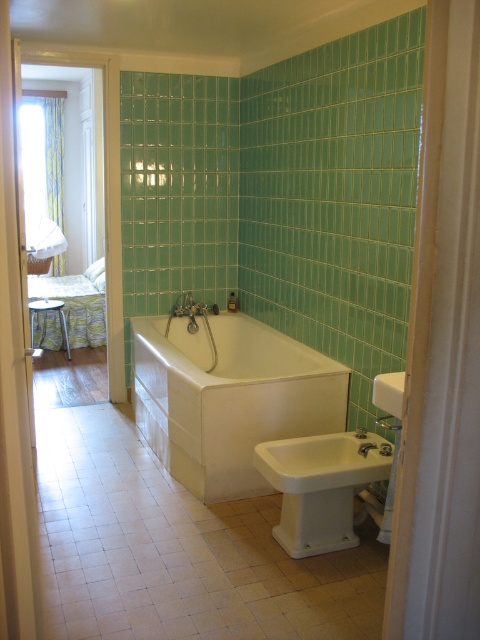
Question: Which of the following is the closest to the observer?

Choices:
 (A) white ceramic sink at lower center
 (B) white ceramic sink at lower right
 (C) white ceramic sink at center
 (D) white glossy bathtub at center

Answer: (C)

Question: Which is farther from the white ceramic sink at lower right?

Choices:
 (A) matte white shower at center
 (B) white ceramic sink at lower center

Answer: (A)

Question: Which point appears closest to the camera in this image?

Choices:
 (A) (392, 426)
 (B) (274, 337)
 (C) (388, 400)
 (D) (280, 538)

Answer: (C)

Question: Can you confirm if white glossy bathtub at center is positioned to the left of white ceramic sink at lower center?

Choices:
 (A) yes
 (B) no

Answer: (A)

Question: Can you confirm if white glossy bathtub at center is wider than matte white shower at center?

Choices:
 (A) no
 (B) yes

Answer: (B)

Question: Is white ceramic sink at lower right behind matte white shower at center?

Choices:
 (A) yes
 (B) no

Answer: (A)